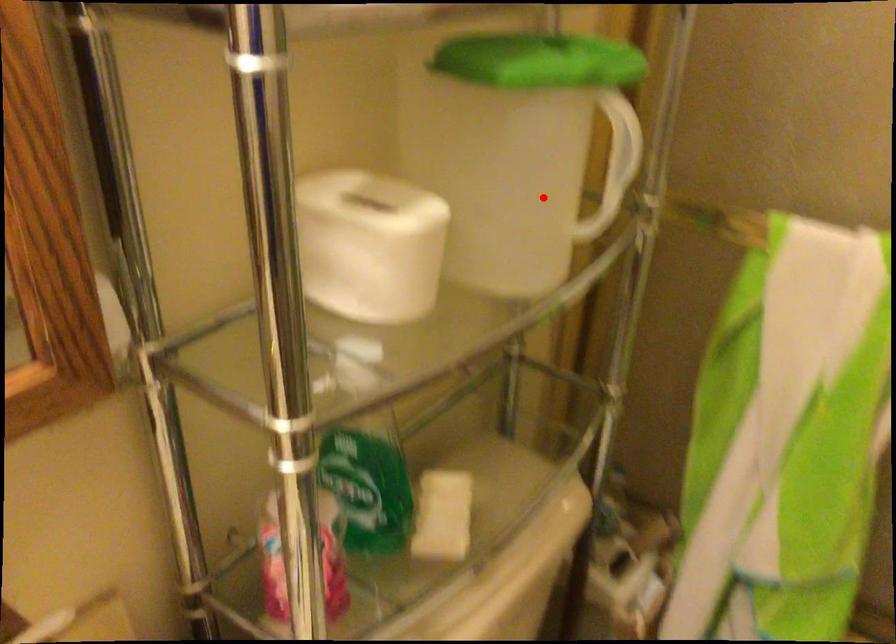
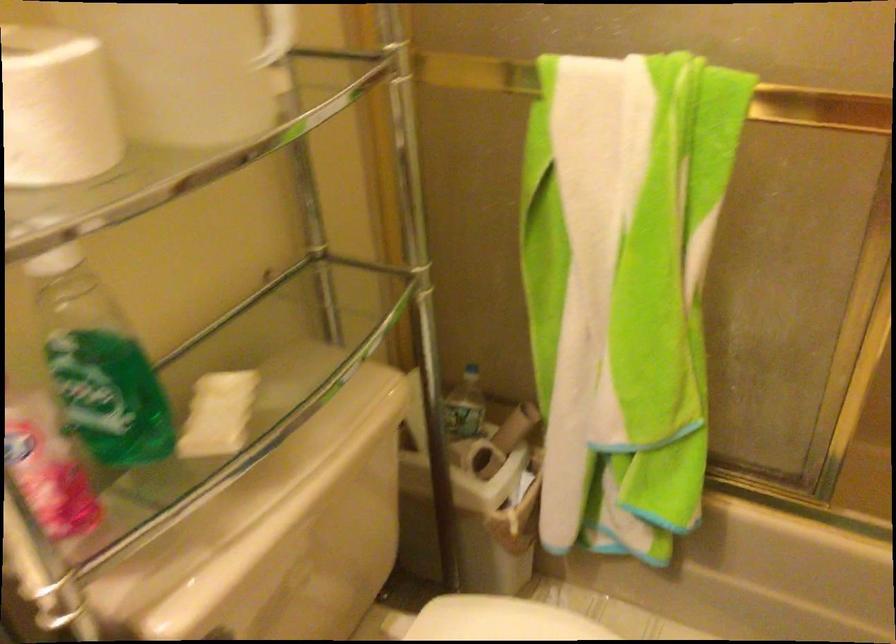
Question: A red point is marked in image1. In image2, is the corresponding 3D point closer to the camera or farther? Reply with the corresponding letter.

Choices:
 (A) The corresponding 3D point is closer.
 (B) The corresponding 3D point is farther.

Answer: (B)